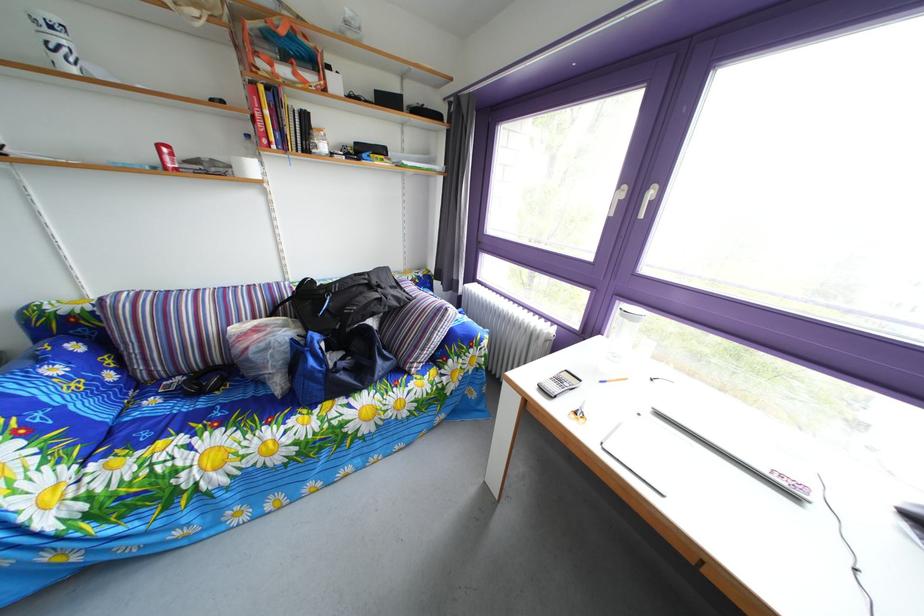
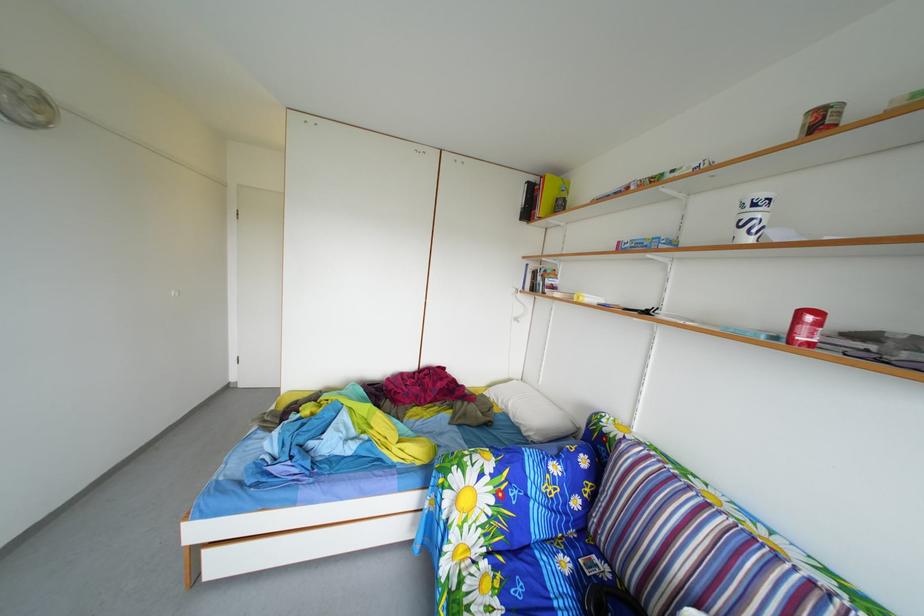
Locate, in the second image, the point that corresponds to pixel 169 155 in the first image.

(811, 321)